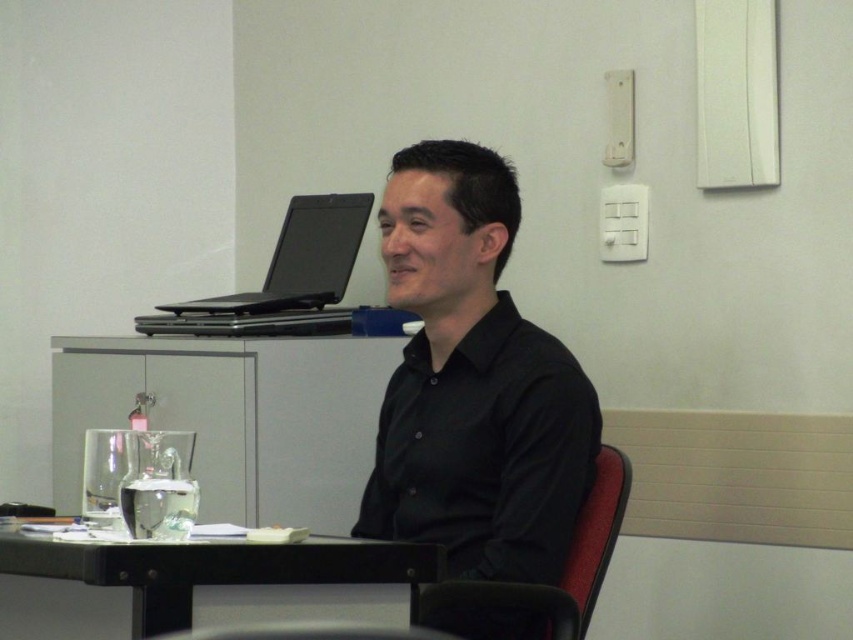
Question: Which point is farther from the camera taking this photo?

Choices:
 (A) (550, 397)
 (B) (438, 604)
 (C) (285, 301)
 (D) (355, 620)

Answer: (C)

Question: Among these objects, which one is farthest from the camera?

Choices:
 (A) black glossy table at lower left
 (B) fabric textured chair at center

Answer: (B)

Question: Considering the relative positions of black matte shirt at center and black glossy table at lower left in the image provided, where is black matte shirt at center located with respect to black glossy table at lower left?

Choices:
 (A) above
 (B) below

Answer: (A)

Question: Does black matte shirt at center lie in front of fabric textured chair at center?

Choices:
 (A) no
 (B) yes

Answer: (A)

Question: From the image, what is the correct spatial relationship of black matte shirt at center in relation to black matte laptop at upper left?

Choices:
 (A) above
 (B) below

Answer: (B)

Question: Which point appears closest to the camera in this image?

Choices:
 (A) (61, 612)
 (B) (595, 499)
 (C) (305, 244)

Answer: (A)